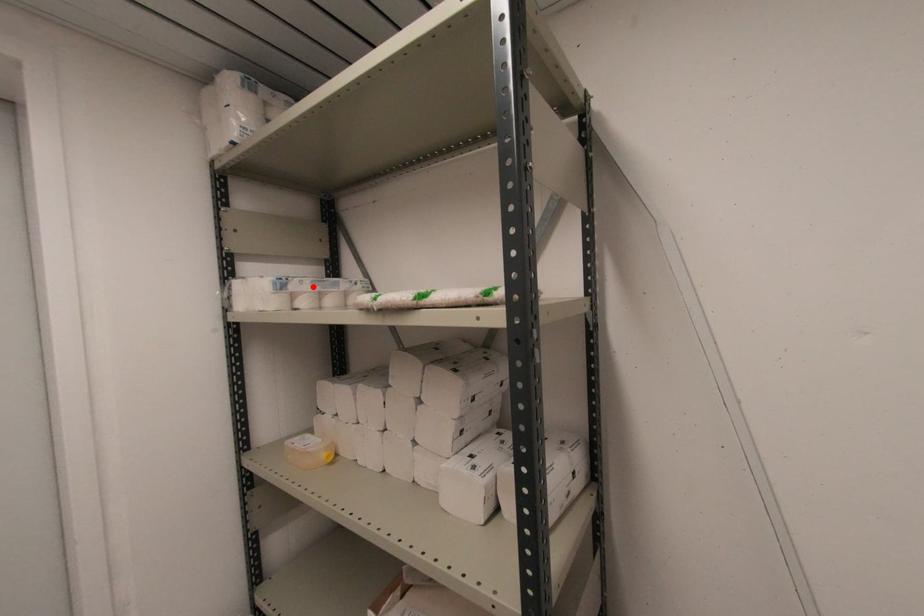
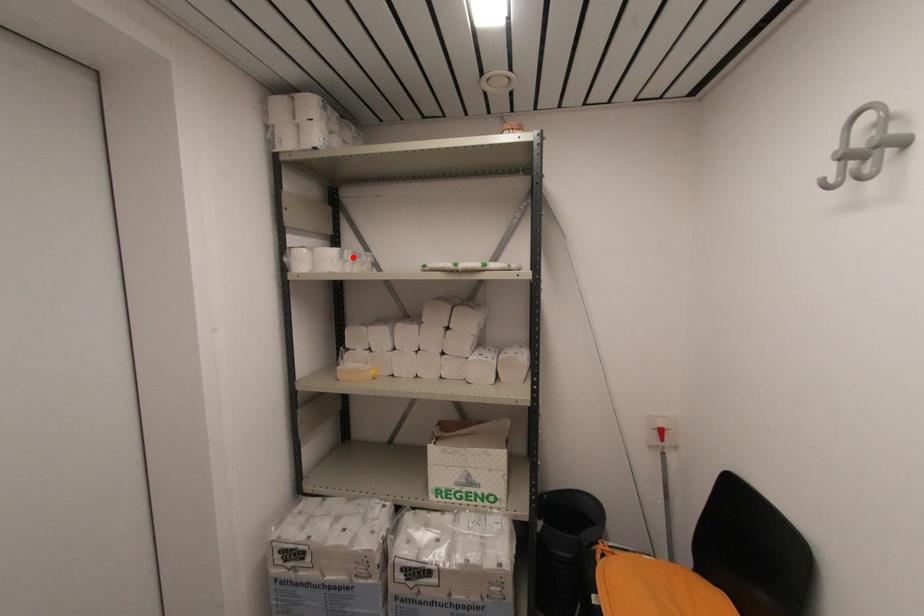
From the picture: I am providing you with two images of the same scene from different viewpoints. A red point is marked on the first image and another point is marked on the second image. Is the marked point in image1 the same physical position as the marked point in image2?

Yes